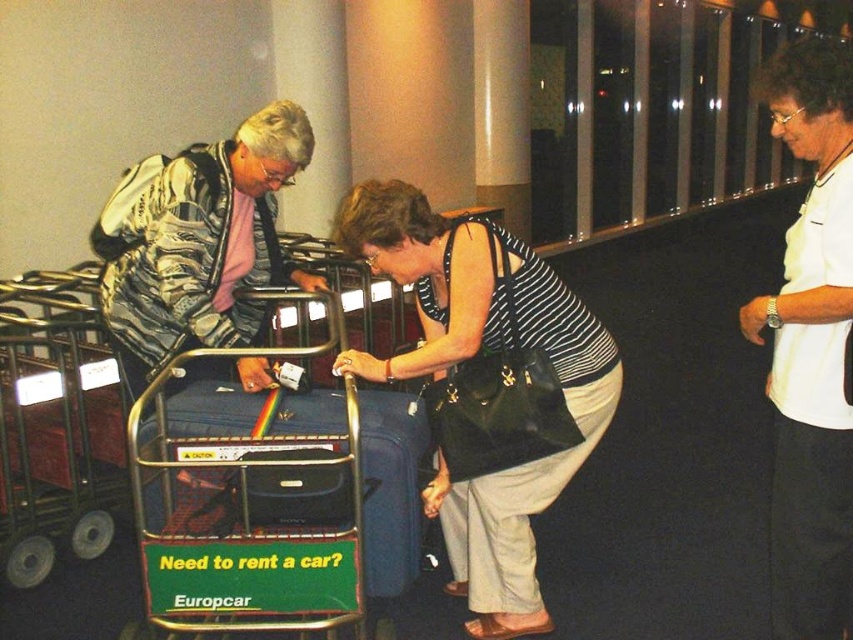
Is point (836, 388) less distant than point (247, 403)?

That is True.

Find the location of a particular element. Image resolution: width=853 pixels, height=640 pixels. white smooth shirt at right is located at coordinates [x=811, y=348].

Which is more to the right, striped fabric top at center or metallic blue luggage cart at center?

From the viewer's perspective, striped fabric top at center appears more on the right side.

Is striped fabric top at center to the left of metallic blue luggage cart at center from the viewer's perspective?

Incorrect, striped fabric top at center is not on the left side of metallic blue luggage cart at center.

Is point (526, 500) in front of point (9, 333)?

Yes, it is.

This screenshot has height=640, width=853. What are the coordinates of `striped fabric top at center` in the screenshot? It's located at (473, 356).

Measure the distance from white smooth shirt at right to camouflage jacket at left.

A distance of 4.97 feet exists between white smooth shirt at right and camouflage jacket at left.

Between white smooth shirt at right and camouflage jacket at left, which one appears on the left side from the viewer's perspective?

camouflage jacket at left

Does point (769, 92) lie behind point (157, 209)?

No, it is not.

In order to click on white smooth shirt at right in this screenshot , I will do `click(811, 348)`.